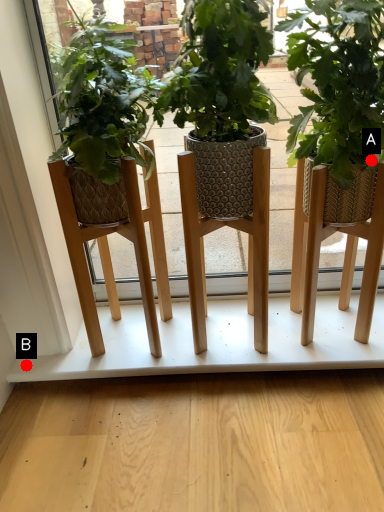
Question: Two points are circled on the image, labeled by A and B beside each circle. Which point is farther from the camera taking this photo?

Choices:
 (A) A is further
 (B) B is further

Answer: (B)